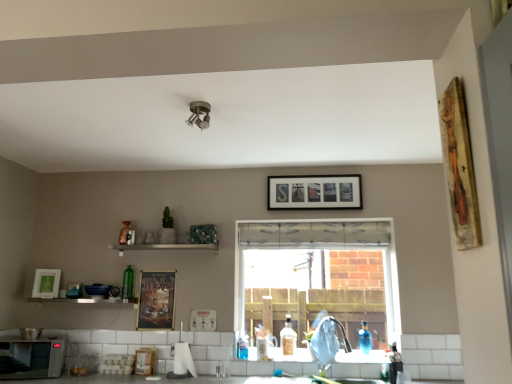
Question: Can you confirm if blue glass bottle at lower right, which is the 3th bottle from back to front, is shorter than metallic poster at center, the second picture frame viewed from the left?

Choices:
 (A) no
 (B) yes

Answer: (B)

Question: Could you tell me if blue glass bottle at lower right, the 2th bottle in the front-to-back sequence, is facing metallic poster at center, marked as the 4th picture frame in a front-to-back arrangement?

Choices:
 (A) yes
 (B) no

Answer: (B)

Question: Is metallic poster at center, which appears as the 2th picture frame when viewed from the back, completely or partially inside blue glass bottle at lower right, arranged as the third bottle when viewed from the left?

Choices:
 (A) no
 (B) yes

Answer: (A)

Question: From a real-world perspective, is blue glass bottle at lower right, arranged as the third bottle when viewed from the left, over metallic poster at center, placed as the second picture frame when sorted from bottom to top?

Choices:
 (A) yes
 (B) no

Answer: (B)

Question: From a real-world perspective, is blue glass bottle at lower right, the 2th bottle in the front-to-back sequence, positioned under metallic poster at center, the 4th picture frame viewed from the top, based on gravity?

Choices:
 (A) yes
 (B) no

Answer: (A)

Question: From a real-world perspective, is translucent glass bottle at sink, which is counted as the 2th bottle, starting from the left, above or below metallic poster at center, which appears as the 2th picture frame when viewed from the back?

Choices:
 (A) below
 (B) above

Answer: (A)

Question: From their relative heights in the image, would you say translucent glass bottle at sink, which is counted as the 2th bottle, starting from the left, is taller or shorter than metallic poster at center, which appears as the 2th picture frame when viewed from the back?

Choices:
 (A) tall
 (B) short

Answer: (B)

Question: Does point tap(282, 340) appear closer or farther from the camera than point tap(142, 311)?

Choices:
 (A) closer
 (B) farther

Answer: (B)

Question: Is translucent glass bottle at sink, placed as the 2th bottle when sorted from back to front, inside the boundaries of metallic poster at center, marked as the 4th picture frame in a front-to-back arrangement, or outside?

Choices:
 (A) inside
 (B) outside

Answer: (B)

Question: Looking at their shapes, would you say blue glass bottle at lower right, which is the 3th bottle from back to front, is wider or thinner than translucent glass bottle at sink, arranged as the 3th bottle when viewed from the front?

Choices:
 (A) thin
 (B) wide

Answer: (B)

Question: Is blue glass bottle at lower right, the 2th bottle in the front-to-back sequence, to the left or to the right of translucent glass bottle at sink, which is counted as the 2th bottle, starting from the left, in the image?

Choices:
 (A) left
 (B) right

Answer: (B)

Question: Is point (369, 342) positioned closer to the camera than point (288, 349)?

Choices:
 (A) closer
 (B) farther

Answer: (B)

Question: From a real-world perspective, is blue glass bottle at lower right, positioned as the 2th bottle in right-to-left order, positioned above or below translucent glass bottle at sink, which is counted as the 2th bottle, starting from the left?

Choices:
 (A) above
 (B) below

Answer: (B)

Question: Based on their positions, is white matte picture frame at left, arranged as the 3th picture frame when viewed from the top, located to the left or right of metallic silver shelf at lower center?

Choices:
 (A) right
 (B) left

Answer: (B)

Question: Do you think white matte picture frame at left, the 3th picture frame ordered from the bottom, is within metallic silver shelf at lower center, or outside of it?

Choices:
 (A) inside
 (B) outside

Answer: (B)